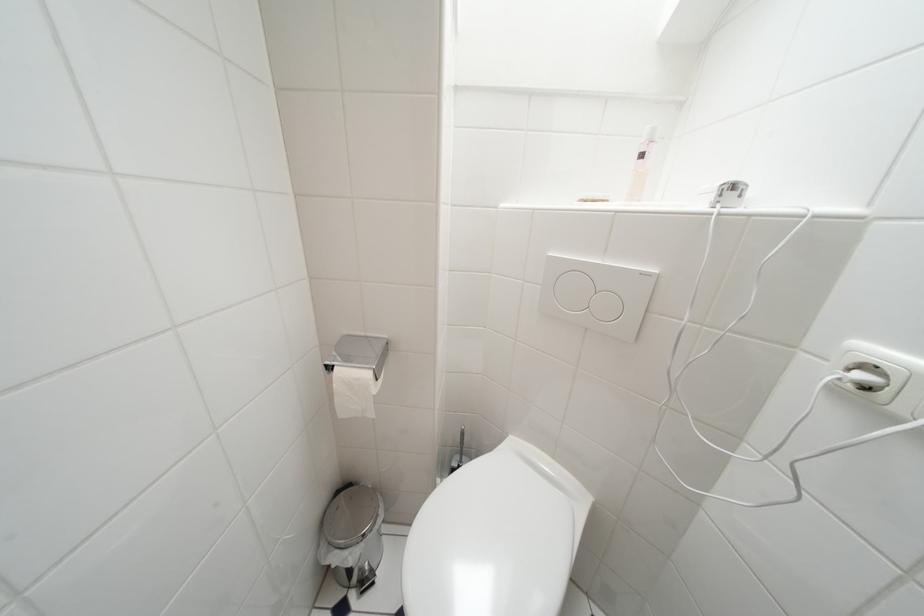
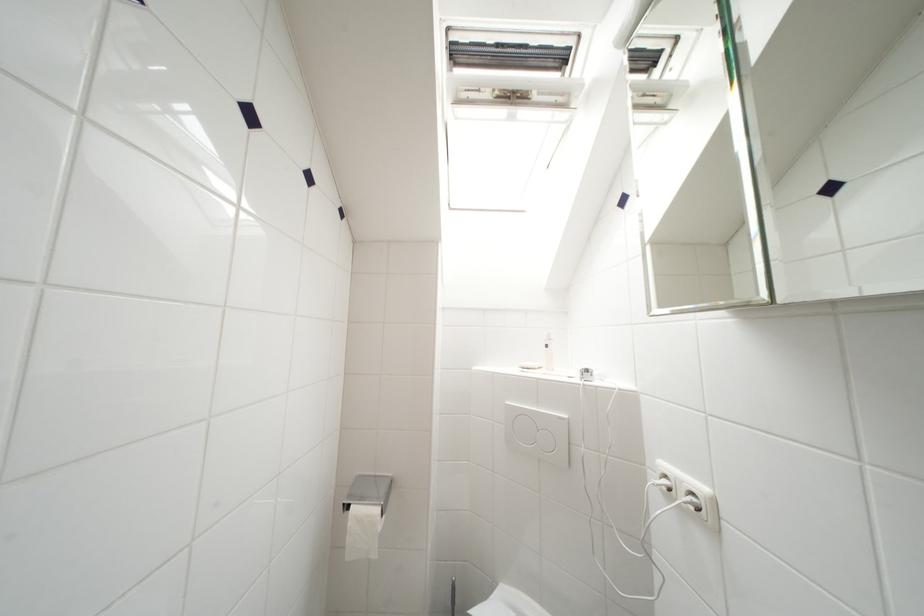
The point at (877, 371) is marked in the first image. Where is the corresponding point in the second image?

(672, 480)